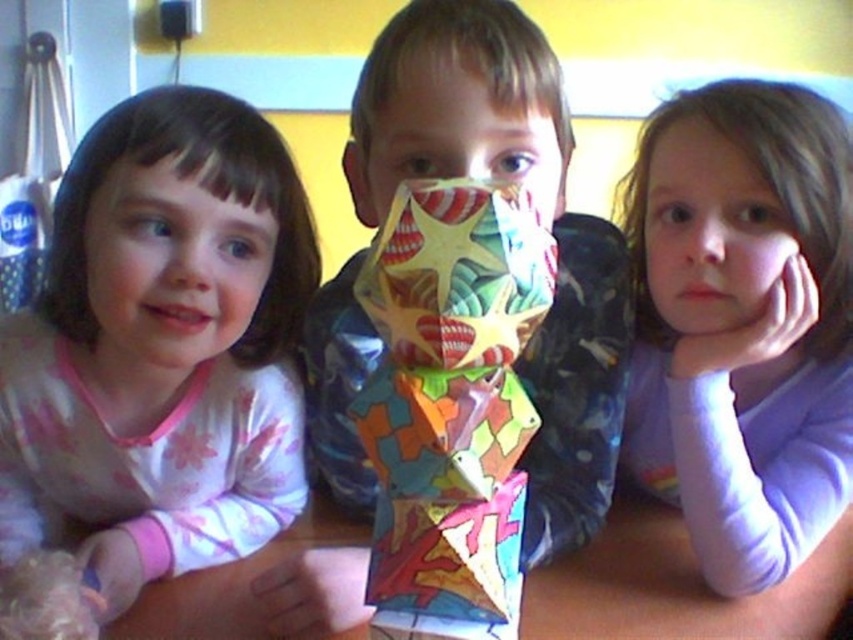
Can you confirm if multicolored paper origami at center is bigger than multicolored paper mask at center?

No.

Does point (460, 570) lie in front of point (428, 72)?

Yes, point (460, 570) is closer to viewer.

Who is more forward, [508,412] or [550,196]?

Point [508,412]

I want to click on multicolored paper origami at center, so click(450, 403).

Who is positioned more to the left, matte pink pajamas at left or pink fabric face at left?

Positioned to the left is pink fabric face at left.

Does matte pink pajamas at left have a larger size compared to pink fabric face at left?

Correct, matte pink pajamas at left is larger in size than pink fabric face at left.

Is point (111, 120) closer to viewer compared to point (112, 273)?

No, it is not.

Where is `matte pink pajamas at left`? matte pink pajamas at left is located at coordinates (161, 346).

Who is positioned more to the right, matte pink pajamas at left or multicolored paper mask at center?

Positioned to the right is multicolored paper mask at center.

Does matte pink pajamas at left appear over multicolored paper mask at center?

Incorrect, matte pink pajamas at left is not positioned above multicolored paper mask at center.

This screenshot has width=853, height=640. Describe the element at coordinates (161, 346) in the screenshot. I see `matte pink pajamas at left` at that location.

Find the location of a particular element. The width and height of the screenshot is (853, 640). matte pink pajamas at left is located at coordinates (161, 346).